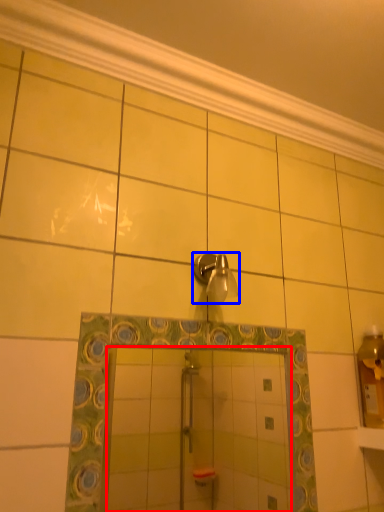
Question: Which object is closer to the camera taking this photo, mirror (highlighted by a red box) or shower (highlighted by a blue box)?

Choices:
 (A) mirror
 (B) shower

Answer: (A)